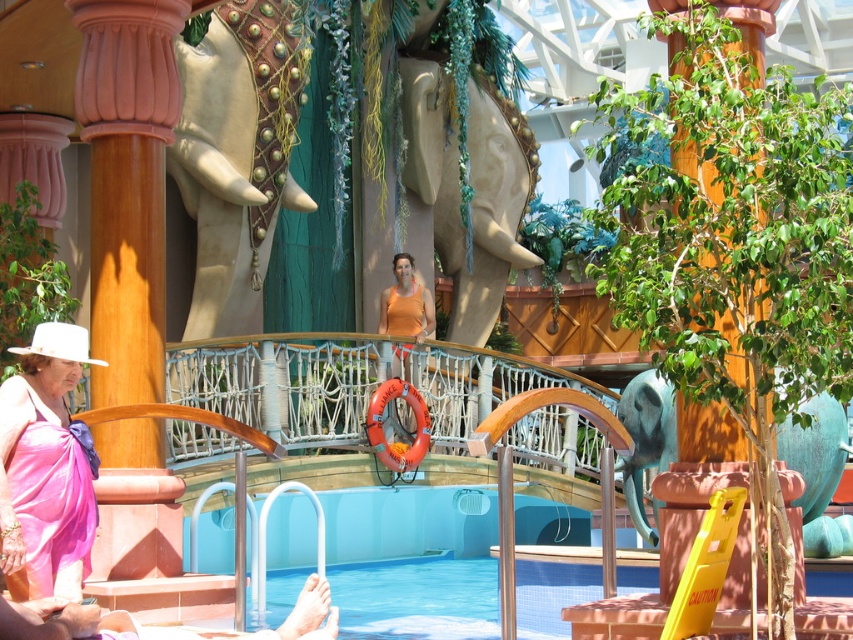
Question: Does pink wood column at left appear over green leafy plant at center?

Choices:
 (A) no
 (B) yes

Answer: (A)

Question: Can you confirm if pink wood column at left is positioned to the right of green leafy plant at center?

Choices:
 (A) no
 (B) yes

Answer: (A)

Question: Among these points, which one is nearest to the camera?

Choices:
 (A) (712, 195)
 (B) (136, 202)

Answer: (A)

Question: Observing the image, what is the correct spatial positioning of pink wood column at left in reference to pink satin dress at lower left?

Choices:
 (A) below
 (B) above

Answer: (B)

Question: Which point is farther to the camera?

Choices:
 (A) green leafy plant at center
 (B) pink satin dress at lower left
 (C) pink wood column at left

Answer: (C)

Question: Which object is closer to the camera taking this photo?

Choices:
 (A) pink satin dress at lower left
 (B) green leafy plant at center

Answer: (B)